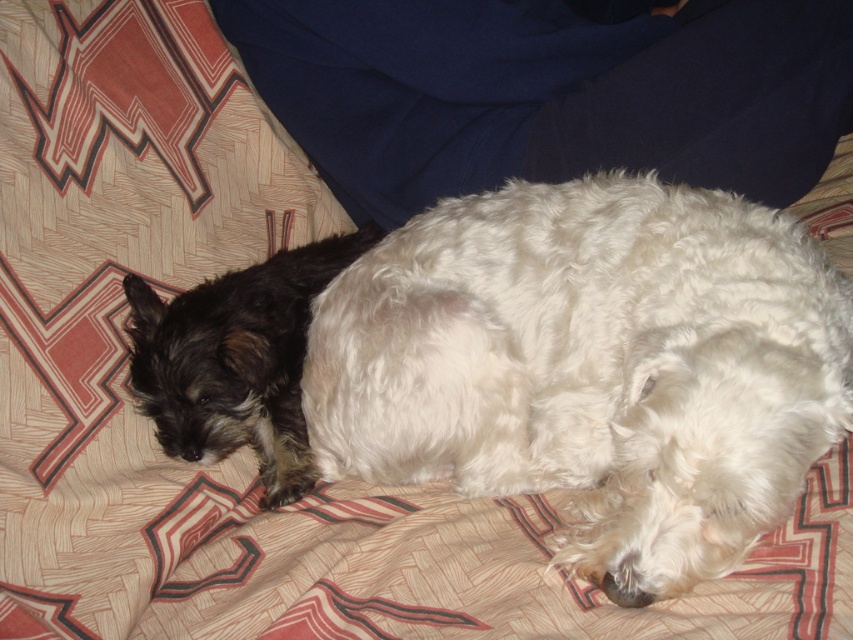
You are a dog groomer who needs to choose the right size grooming table for two dogs. The white fluffy dog at center and the shaggy black dog at left. Which dog requires a larger grooming table based on their size?

The white fluffy dog at center requires a larger grooming table because its width is greater than the shaggy black dog at left.

Based on the photo, you are looking at the image of two dogs on a bed. There are two points marked in the scene. Based on their positions, which point is closer to you, point (724, 545) or point (131, 314)?

Point (724, 545) is closer to the viewer than point (131, 314).

You are a photographer setting up a shot of the two dogs on the bed. You want to position a small toy between them so that it is closer to the shaggy black dog at left than the white fluffy dog at center. Based on their current positions, where should you place the toy?

The white fluffy dog at center is to the right of the shaggy black dog at left, so placing the toy closer to the shaggy black dog at left would mean positioning it between them but nearer to the left side of the shaggy black dog at left.